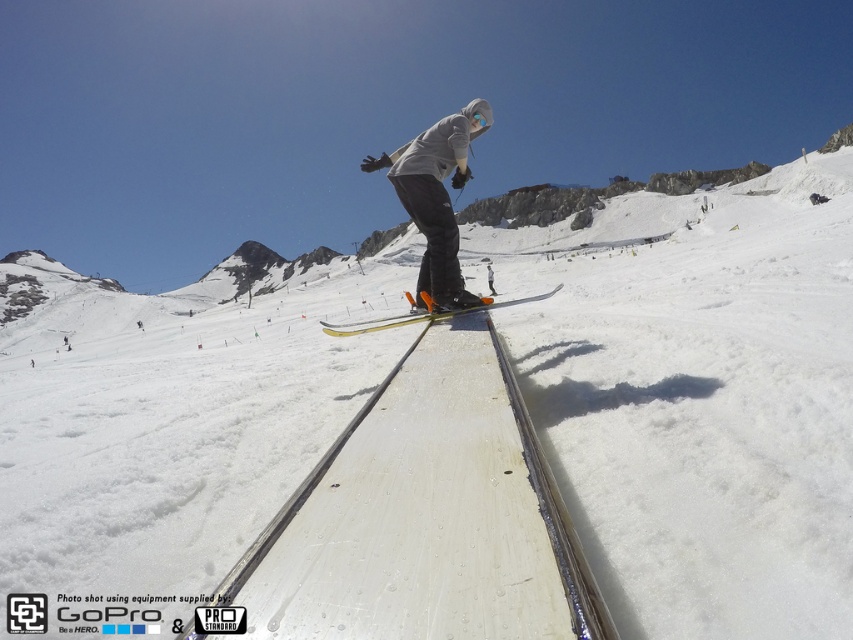
In the scene shown: Is gray fleece jacket at center further to the viewer compared to yellow metallic skis at center?

That is False.

Can you confirm if gray fleece jacket at center is bigger than yellow metallic skis at center?

Actually, gray fleece jacket at center might be smaller than yellow metallic skis at center.

What do you see at coordinates (436, 202) in the screenshot? This screenshot has height=640, width=853. I see `gray fleece jacket at center` at bounding box center [436, 202].

Find the location of a particular element. Image resolution: width=853 pixels, height=640 pixels. gray fleece jacket at center is located at coordinates (436, 202).

Is the position of white matte snowboarder at center more distant than that of yellow metallic skis at center?

Yes, white matte snowboarder at center is behind yellow metallic skis at center.

Is point (460, 180) positioned after point (503, 300)?

That is False.

Is point (408, 198) positioned behind point (436, 307)?

Yes, it is behind point (436, 307).

Find the location of `white matte snowboarder at center`. white matte snowboarder at center is located at coordinates (436, 195).

Who is more distant from viewer, (448,301) or (422,150)?

The point (422,150) is more distant.

Between gray fleece jacket at center and white matte snowboarder at center, which one is positioned lower?

gray fleece jacket at center is below.

Does point (479, 305) come closer to viewer compared to point (408, 152)?

That is True.

Find the location of a particular element. gray fleece jacket at center is located at coordinates (436, 202).